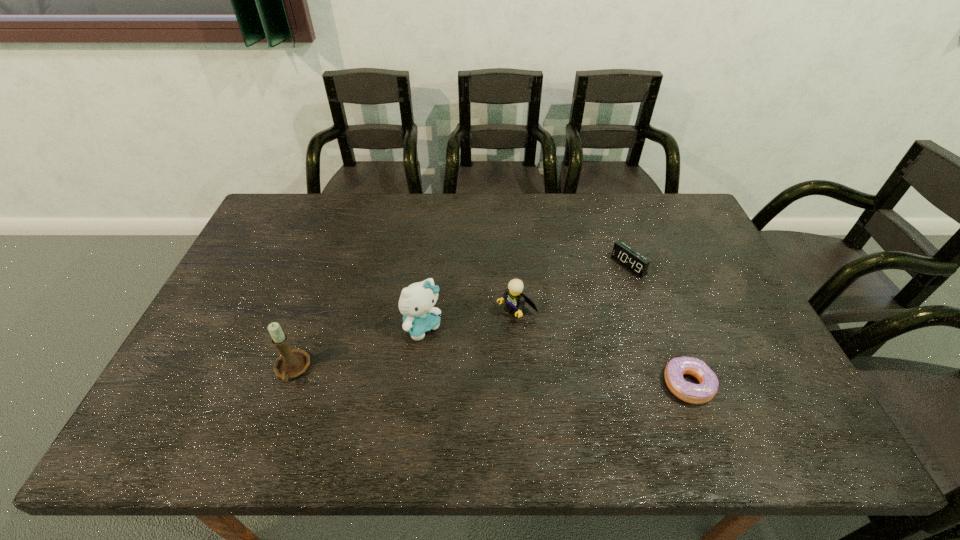
Where is `free space located on the front-facing side of the third object from right to left`? free space located on the front-facing side of the third object from right to left is located at coordinates (477, 341).

This screenshot has height=540, width=960. Find the location of `free space located on the front-facing side of the fourth tallest object`. free space located on the front-facing side of the fourth tallest object is located at coordinates [x=596, y=287].

Find the location of a particular element. This screenshot has height=540, width=960. blank space located on the front-facing side of the fourth tallest object is located at coordinates point(540,321).

This screenshot has height=540, width=960. Find the location of `free spot located 0.110m on the front-facing side of the fourth tallest object`. free spot located 0.110m on the front-facing side of the fourth tallest object is located at coordinates (593, 288).

Locate an element on the screen. free space located on the face of the kitten is located at coordinates (480, 393).

Where is `vacant point located on the face of the kitten`? Image resolution: width=960 pixels, height=540 pixels. vacant point located on the face of the kitten is located at coordinates (465, 376).

Locate an element on the screen. blank area located on the face of the kitten is located at coordinates (475, 387).

Where is `candle holder located at the near edge`? This screenshot has width=960, height=540. candle holder located at the near edge is located at coordinates (290, 364).

Identify the location of doughnut that is at the near edge. (689, 392).

In the image, there is a desktop. Identify the location of vacant region at the far edge. (348, 232).